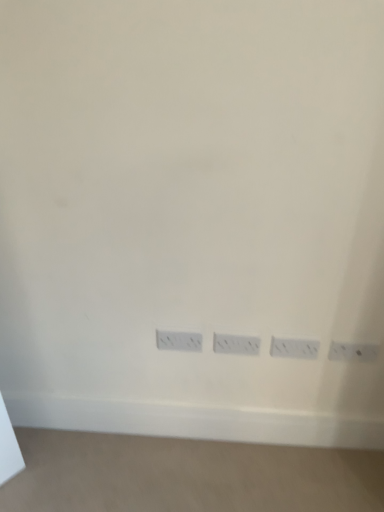
Question: Considering the relative positions of white plastic power plugs and sockets at lower center, which is counted as the 4th power plugs and sockets, starting from the right, and white plastic power plugs and sockets at lower right, placed as the 4th power plugs and sockets when sorted from left to right, in the image provided, is white plastic power plugs and sockets at lower center, which is counted as the 4th power plugs and sockets, starting from the right, to the left of white plastic power plugs and sockets at lower right, placed as the 4th power plugs and sockets when sorted from left to right, from the viewer's perspective?

Choices:
 (A) no
 (B) yes

Answer: (B)

Question: From a real-world perspective, is white plastic power plugs and sockets at lower center, which is counted as the 4th power plugs and sockets, starting from the right, physically below white plastic power plugs and sockets at lower right, placed as the 4th power plugs and sockets when sorted from left to right?

Choices:
 (A) no
 (B) yes

Answer: (B)

Question: From the image's perspective, does white plastic power plugs and sockets at lower center, which is counted as the 4th power plugs and sockets, starting from the right, appear lower than white plastic power plugs and sockets at lower right, the 1th power plugs and sockets from the right?

Choices:
 (A) yes
 (B) no

Answer: (B)

Question: Is white plastic power plugs and sockets at lower right, placed as the 4th power plugs and sockets when sorted from left to right, at the back of white plastic power plugs and sockets at lower center, which is counted as the 4th power plugs and sockets, starting from the right?

Choices:
 (A) no
 (B) yes

Answer: (A)

Question: Considering the relative positions of white plastic power plugs and sockets at lower center, which appears as the first power plugs and sockets when viewed from the left, and white plastic power plugs and sockets at lower right, the 1th power plugs and sockets from the right, in the image provided, is white plastic power plugs and sockets at lower center, which appears as the first power plugs and sockets when viewed from the left, to the right of white plastic power plugs and sockets at lower right, the 1th power plugs and sockets from the right, from the viewer's perspective?

Choices:
 (A) no
 (B) yes

Answer: (A)

Question: From the image's perspective, is white plastic power plugs and sockets at lower center, which appears as the first power plugs and sockets when viewed from the left, on white plastic power plugs and sockets at lower right, placed as the 4th power plugs and sockets when sorted from left to right?

Choices:
 (A) yes
 (B) no

Answer: (A)

Question: Considering the relative sizes of white plastic power plugs and sockets at center, positioned as the third power plugs and sockets in right-to-left order, and white plastic power plugs and sockets at center, which is the second power plugs and sockets from right to left, in the image provided, is white plastic power plugs and sockets at center, positioned as the third power plugs and sockets in right-to-left order, smaller than white plastic power plugs and sockets at center, which is the second power plugs and sockets from right to left,?

Choices:
 (A) no
 (B) yes

Answer: (B)

Question: Are white plastic power plugs and sockets at center, the second power plugs and sockets when ordered from left to right, and white plastic power plugs and sockets at center, which is the second power plugs and sockets from right to left, making contact?

Choices:
 (A) no
 (B) yes

Answer: (A)

Question: Is white plastic power plugs and sockets at center, the second power plugs and sockets when ordered from left to right, completely or partially outside of white plastic power plugs and sockets at center, which is the second power plugs and sockets from right to left?

Choices:
 (A) yes
 (B) no

Answer: (A)

Question: Is white plastic power plugs and sockets at center, the second power plugs and sockets when ordered from left to right, at the left side of white plastic power plugs and sockets at center, which is the second power plugs and sockets from right to left?

Choices:
 (A) yes
 (B) no

Answer: (A)

Question: Is white plastic power plugs and sockets at center, positioned as the third power plugs and sockets in right-to-left order, far away from white plastic power plugs and sockets at center, positioned as the 3th power plugs and sockets in left-to-right order?

Choices:
 (A) yes
 (B) no

Answer: (B)

Question: From a real-world perspective, does white plastic power plugs and sockets at center, positioned as the third power plugs and sockets in right-to-left order, sit lower than white plastic power plugs and sockets at center, which is the second power plugs and sockets from right to left?

Choices:
 (A) no
 (B) yes

Answer: (B)

Question: Can you confirm if white plastic power plugs and sockets at center, positioned as the 3th power plugs and sockets in left-to-right order, is taller than white plastic power plugs and sockets at lower right, placed as the 4th power plugs and sockets when sorted from left to right?

Choices:
 (A) yes
 (B) no

Answer: (A)